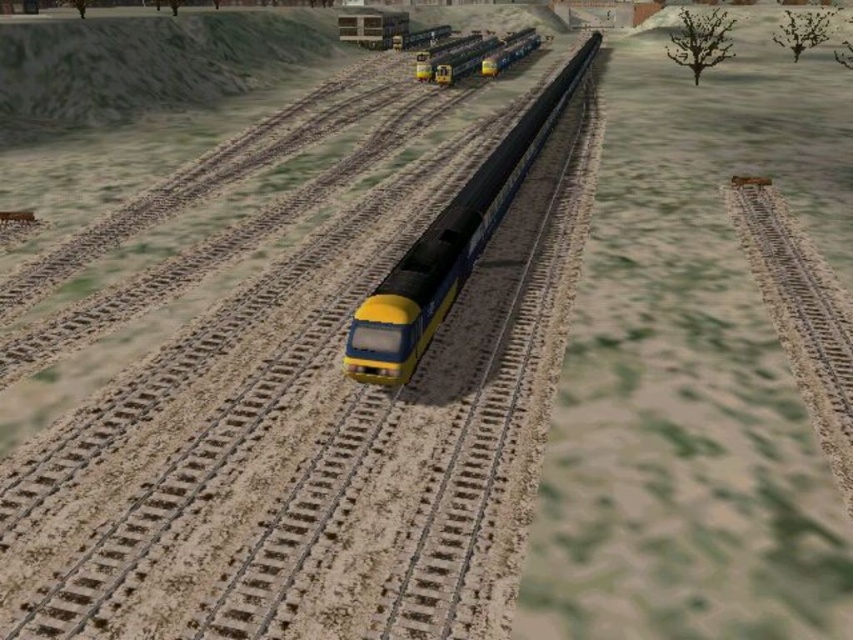
You are a photographer trying to capture both the yellow matte train at center and the yellow matte train at upper center in a single shot. Based on their positions, which train should you focus on first to ensure both are in frame?

You should focus on the yellow matte train at center first because it is taller than the yellow matte train at upper center, allowing you to adjust the framing to include both.

You are a passenger on the yellow matte train at center and want to know if you can see the yellow matte train at upper center from your current position. Based on their sizes and positions, can you see it?

The yellow matte train at center is larger than the yellow matte train at upper center. Since the train at center is bigger, it might block your view of the smaller one at upper center depending on their exact positions, but the description doesn not specify distance or exact placement beyond size. Without more details, it is uncertain if the smaller train is visible.

You are standing at the point with coordinates (451,244) in the snowy railway scene. What object are you currently standing on?

The point at coordinates (451,244) corresponds to the yellow matte train at center, so you are standing on the yellow matte train at center.